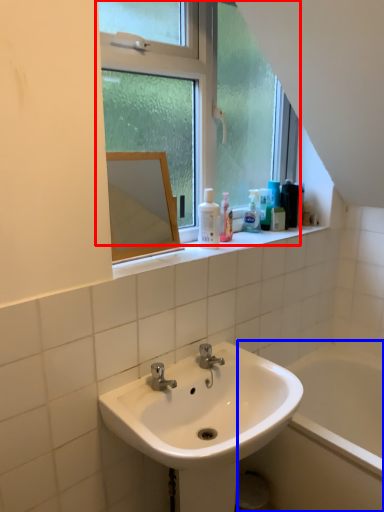
Question: Which object is closer to the camera taking this photo, window (highlighted by a red box) or bath (highlighted by a blue box)?

Choices:
 (A) window
 (B) bath

Answer: (A)